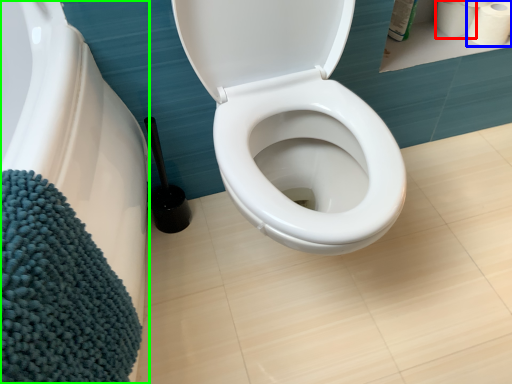
Question: Estimate the real-world distances between objects in this image. Which object is closer to toilet paper (highlighted by a red box), toilet paper (highlighted by a blue box) or bath (highlighted by a green box)?

Choices:
 (A) toilet paper
 (B) bath

Answer: (A)